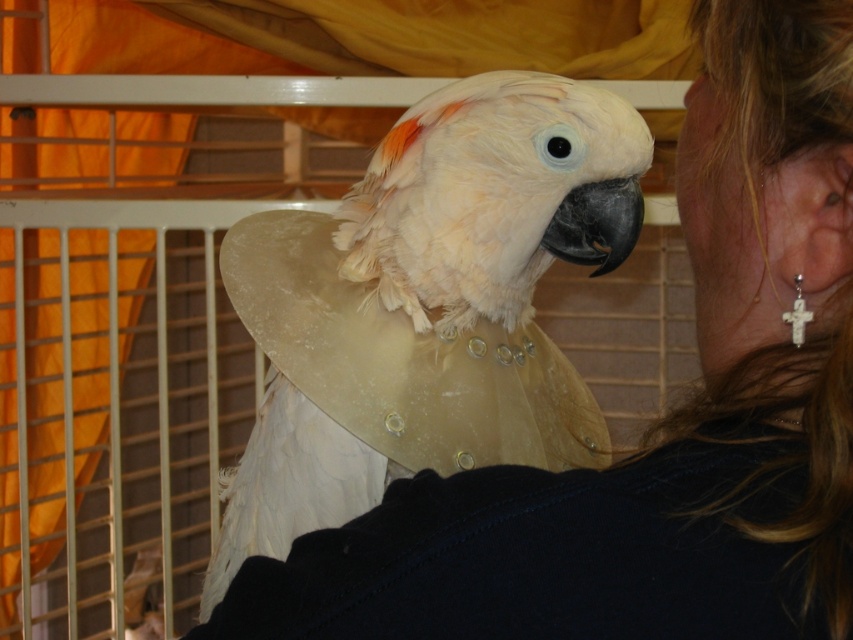
Is white cross earring at right in front of white ceramic cross at ear?

Yes, it is in front of white ceramic cross at ear.

Is point (779, 131) less distant than point (804, 307)?

Yes.

I want to click on white cross earring at right, so click(x=767, y=188).

Between white feathered parrot at center and white cross earring at right, which one has more height?

With more height is white feathered parrot at center.

How distant is white feathered parrot at center from white cross earring at right?

Answer: white feathered parrot at center and white cross earring at right are 16.07 inches apart from each other.

This screenshot has width=853, height=640. Identify the location of white feathered parrot at center. (416, 310).

Between white feathered parrot at center and white ceramic cross at ear, which one is positioned higher?

white ceramic cross at ear

Which is below, white feathered parrot at center or white ceramic cross at ear?

Positioned lower is white feathered parrot at center.

Identify the location of white feathered parrot at center. (416, 310).